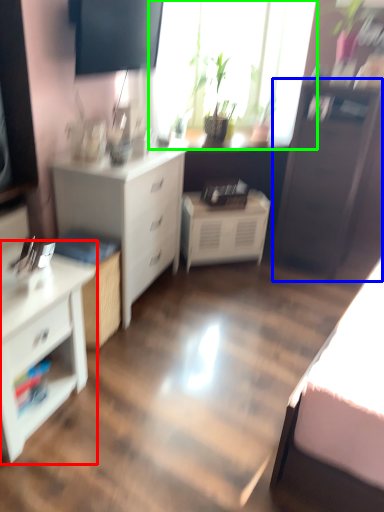
Question: Which object is the closest to the chest of drawers (highlighted by a red box)? Choose among these: file cabinet (highlighted by a blue box) or window (highlighted by a green box).

Choices:
 (A) file cabinet
 (B) window

Answer: (A)